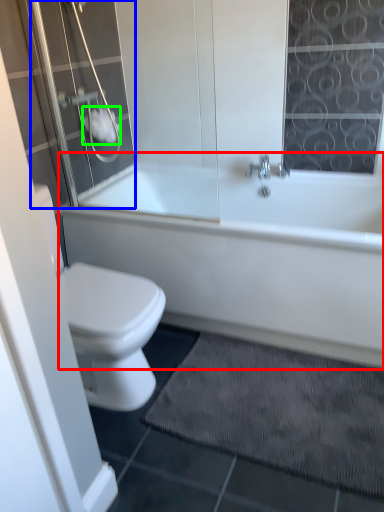
Question: Based on their relative distances, which object is nearer to bathtub (highlighted by a red box)? Choose from shower door (highlighted by a blue box) and toilet paper (highlighted by a green box).

Choices:
 (A) shower door
 (B) toilet paper

Answer: (A)